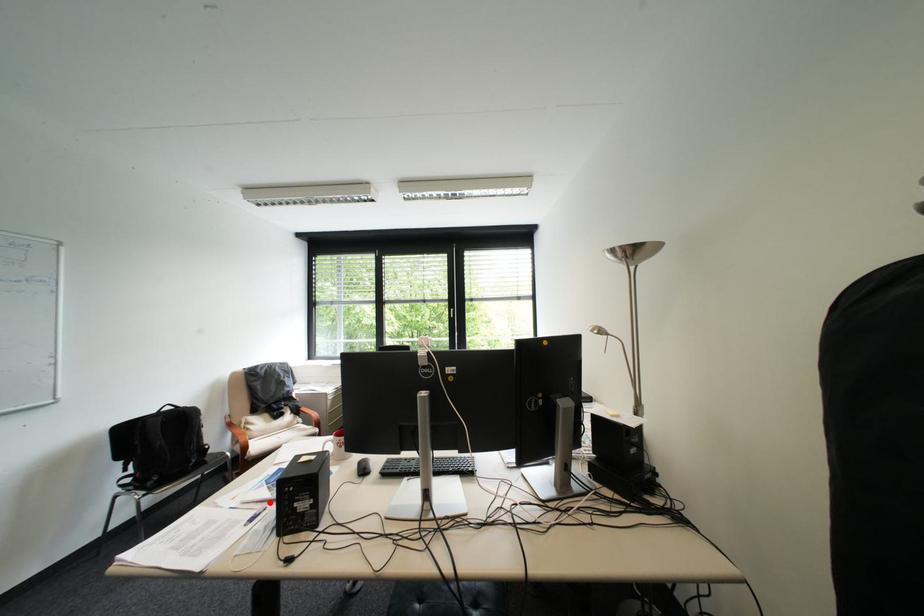
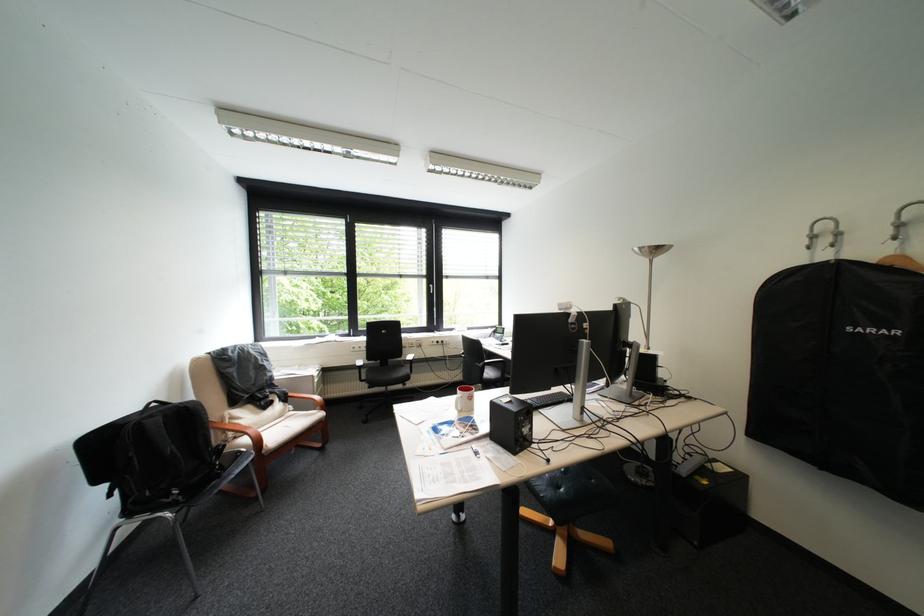
Question: I am providing you with two images of the same scene from different viewpoints. Given a red point in image1, look at the same physical point in image2. Is it:

Choices:
 (A) Closer to the viewpoint
 (B) Farther from the viewpoint

Answer: (A)